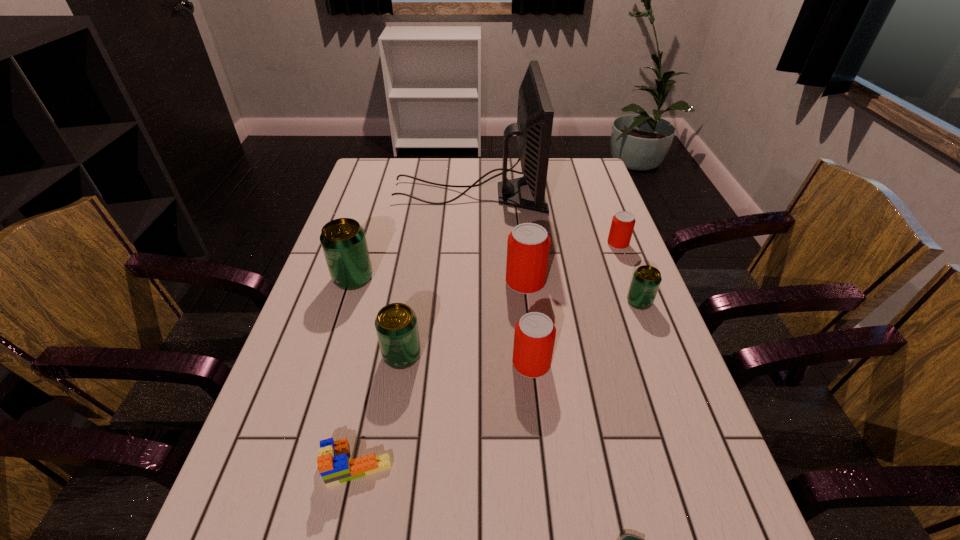
Locate an element on the screen. free space located 0.080m on the back of the smallest red beer can is located at coordinates (610, 222).

Identify the location of vacant space situated on the right of the Lego. The height and width of the screenshot is (540, 960). (511, 465).

Where is `object at the far edge`? object at the far edge is located at coordinates point(533,129).

Identify the location of computer monitor located in the left edge section of the desktop. (533, 129).

This screenshot has width=960, height=540. I want to click on beer can that is at the left edge, so click(x=343, y=240).

Locate an element on the screen. The width and height of the screenshot is (960, 540). Lego positioned at the left edge is located at coordinates (333, 464).

Identify the location of object present at the far left corner. The width and height of the screenshot is (960, 540). (x=533, y=129).

Locate an element on the screen. The height and width of the screenshot is (540, 960). free space at the far edge is located at coordinates (482, 183).

This screenshot has height=540, width=960. In order to click on free location at the left edge of the desktop in this screenshot , I will do `click(334, 286)`.

Locate an element on the screen. This screenshot has width=960, height=540. vacant area at the right edge of the desktop is located at coordinates (587, 252).